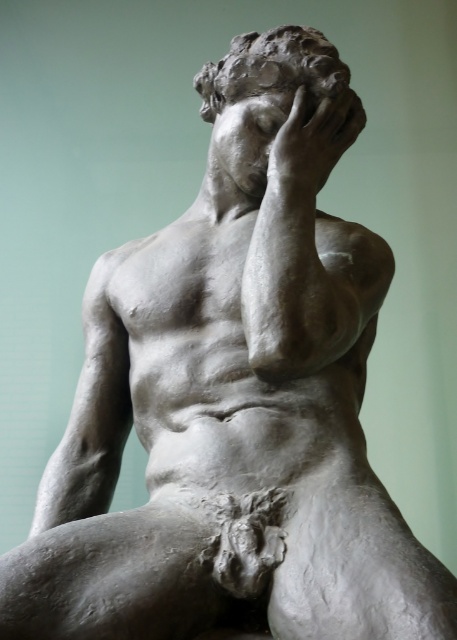
Question: Does matte gray sculpture at center appear over matte gray hand at upper center?

Choices:
 (A) yes
 (B) no

Answer: (A)

Question: Which of the following is the farthest from the observer?

Choices:
 (A) (282, 92)
 (B) (333, 161)

Answer: (B)

Question: Is matte gray sculpture at center behind matte gray hand at upper center?

Choices:
 (A) no
 (B) yes

Answer: (B)

Question: In this image, where is matte gray sculpture at center located relative to matte gray hand at upper center?

Choices:
 (A) right
 (B) left

Answer: (B)

Question: Which of the following is the farthest from the observer?

Choices:
 (A) matte gray hand at upper center
 (B) matte gray sculpture at center

Answer: (B)